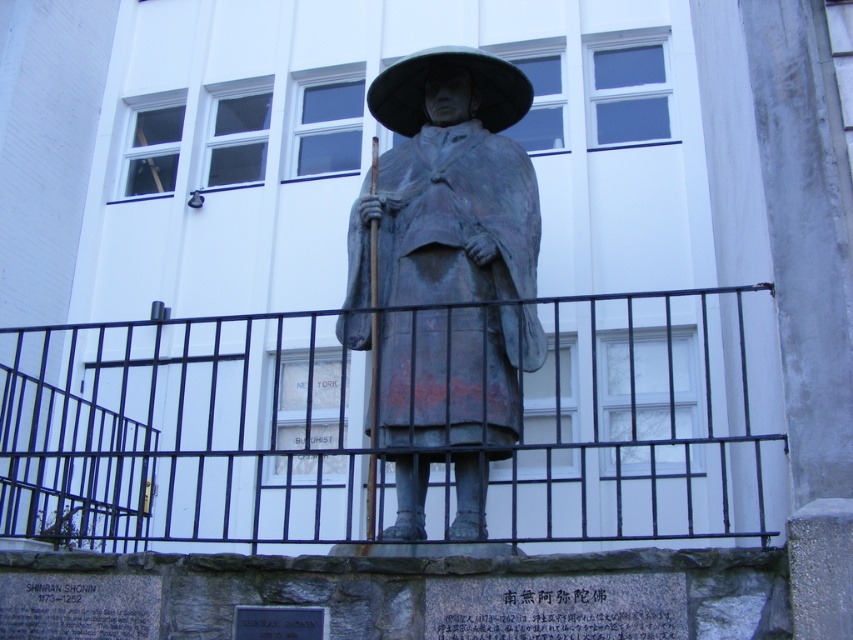
In the scene shown: Who is more forward, [556,342] or [479,368]?

Point [556,342]

Who is more forward, (228, 449) or (426, 132)?

Positioned in front is point (426, 132).

What are the coordinates of `black metal fence at center` in the screenshot? It's located at (183, 432).